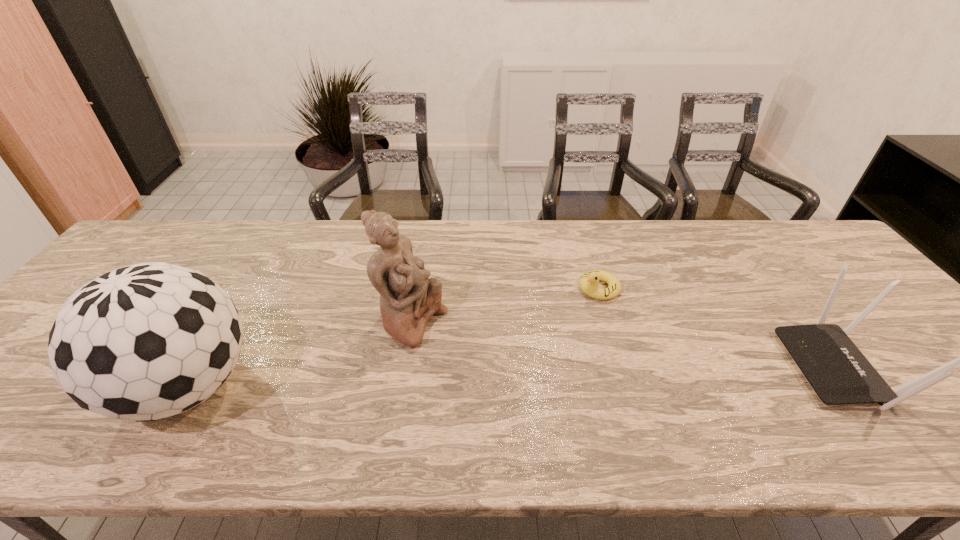
The width and height of the screenshot is (960, 540). I want to click on vacant space at the far edge of the desktop, so click(509, 240).

This screenshot has height=540, width=960. In the image, there is a desktop. Identify the location of blank space at the right edge. (853, 275).

This screenshot has height=540, width=960. In order to click on free space at the far left corner in this screenshot , I will do `click(151, 245)`.

Where is `free space at the far right corner of the desktop`? This screenshot has width=960, height=540. free space at the far right corner of the desktop is located at coordinates (804, 249).

Locate an element on the screen. empty location between the figurine and the soccer ball is located at coordinates (300, 354).

Locate an element on the screen. The width and height of the screenshot is (960, 540). unoccupied area between the duckling and the router is located at coordinates (719, 328).

The width and height of the screenshot is (960, 540). In order to click on unoccupied position between the leftmost object and the figurine in this screenshot , I will do `click(300, 354)`.

Image resolution: width=960 pixels, height=540 pixels. In order to click on vacant area between the third object from right to left and the third object from left to right in this screenshot , I will do `click(506, 305)`.

You are a GUI agent. You are given a task and a screenshot of the screen. Output one action in this format:
    pyautogui.click(x=<x>, y=<y>)
    Task: Click on the vacant area that lies between the rightmost object and the soccer ball
    
    Given the screenshot: What is the action you would take?
    514,377

What are the coordinates of `free space that is in between the second object from left to right and the second object from right to left` in the screenshot? It's located at (506, 305).